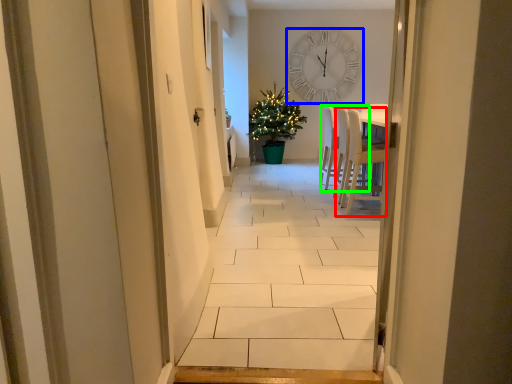
Question: Estimate the real-world distances between objects in this image. Which object is farther from chair (highlighted by a red box), wall clock (highlighted by a blue box) or armchair (highlighted by a green box)?

Choices:
 (A) wall clock
 (B) armchair

Answer: (A)